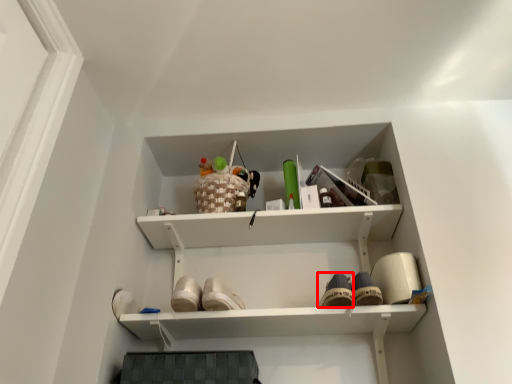
Question: In this image, where is shoe (annotated by the red box) located relative to toy?

Choices:
 (A) right
 (B) left

Answer: (A)